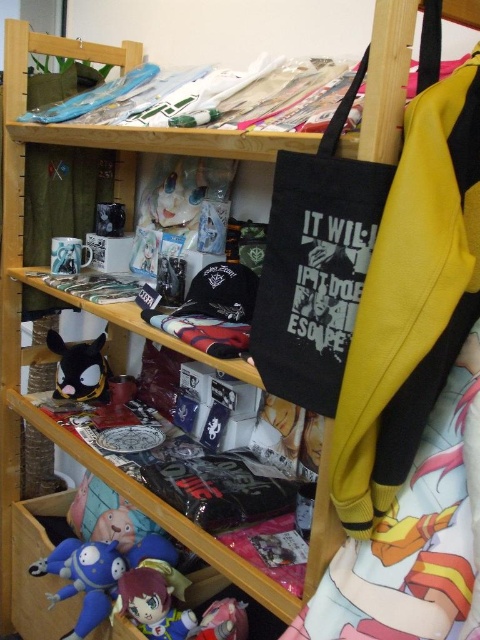
At what (x,y) coordinates should I click in order to perform the action: click on black canvas tote at upper right. Please return your answer as a coordinate pair (x, y). Image resolution: width=480 pixels, height=640 pixels. Looking at the image, I should click on (315, 264).

Is black canvas tote at upper right below blue plush toy at lower left?

Incorrect, black canvas tote at upper right is not positioned below blue plush toy at lower left.

At what (x,y) coordinates should I click in order to perform the action: click on black canvas tote at upper right. Please return your answer as a coordinate pair (x, y). This screenshot has height=640, width=480. Looking at the image, I should click on (315, 264).

Does point (343, 182) come behind point (166, 605)?

That is False.

Who is more distant from viewer, (388, 186) or (176, 620)?

The point (176, 620) is behind.

Where is `black canvas tote at upper right`? black canvas tote at upper right is located at coordinates (315, 264).

Which of these two, plush toy at lower center or matte pink plush at lower center, stands taller?

plush toy at lower center is taller.

Is plush toy at lower center shorter than matte pink plush at lower center?

No, plush toy at lower center is not shorter than matte pink plush at lower center.

Describe the element at coordinates (153, 604) in the screenshot. This screenshot has width=480, height=640. I see `plush toy at lower center` at that location.

Locate an element on the screen. The height and width of the screenshot is (640, 480). plush toy at lower center is located at coordinates (153, 604).